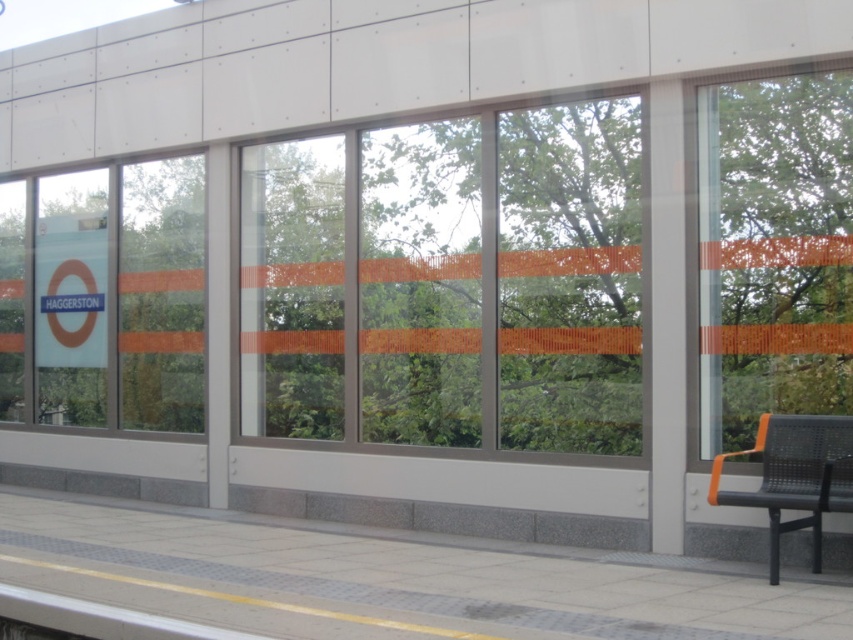
You are a passenger waiting at the train station and need to decide whether to sit on the black metal bench at right or stand near the transparent glass window at right. If you want to have more personal space around you, which option would you choose and why?

You should choose to stand near the transparent glass window at right because its width is larger than the black metal bench at right, providing more space around you.

You are a passenger waiting at the train station and want to check the schedule displayed on the glass walls. Which of the two windows, the transparent glass window at center or the transparent glass window at right, is taller and thus more likely to have the full schedule displayed?

The transparent glass window at center is taller than the transparent glass window at right, so it is more likely to have the full schedule displayed.